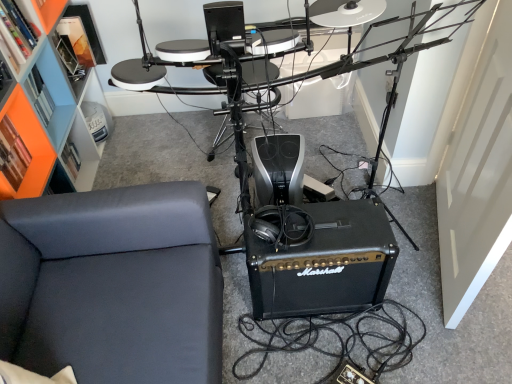
Question: Considering the relative sizes of black leather couch at lower left and black matte marshall amplifier at center in the image provided, is black leather couch at lower left shorter than black matte marshall amplifier at center?

Choices:
 (A) no
 (B) yes

Answer: (A)

Question: From a real-world perspective, is black leather couch at lower left physically below black matte marshall amplifier at center?

Choices:
 (A) no
 (B) yes

Answer: (A)

Question: From the image's perspective, does black leather couch at lower left appear higher than black matte marshall amplifier at center?

Choices:
 (A) no
 (B) yes

Answer: (A)

Question: From the image's perspective, is black leather couch at lower left under black matte marshall amplifier at center?

Choices:
 (A) no
 (B) yes

Answer: (B)

Question: Is black leather couch at lower left at the left side of black matte marshall amplifier at center?

Choices:
 (A) no
 (B) yes

Answer: (B)

Question: Is point (74, 200) closer or farther from the camera than point (22, 18)?

Choices:
 (A) closer
 (B) farther

Answer: (A)

Question: Is black leather couch at lower left bigger or smaller than orange matte bookshelf at upper left?

Choices:
 (A) small
 (B) big

Answer: (B)

Question: Is black leather couch at lower left taller or shorter than orange matte bookshelf at upper left?

Choices:
 (A) tall
 (B) short

Answer: (A)

Question: Choose the correct answer: Is black leather couch at lower left inside orange matte bookshelf at upper left or outside it?

Choices:
 (A) outside
 (B) inside

Answer: (A)

Question: In terms of size, does orange matte bookshelf at upper left appear bigger or smaller than black plastic drum set at center?

Choices:
 (A) big
 (B) small

Answer: (B)

Question: From the image's perspective, is orange matte bookshelf at upper left located above or below black plastic drum set at center?

Choices:
 (A) below
 (B) above

Answer: (B)

Question: From a real-world perspective, is orange matte bookshelf at upper left above or below black plastic drum set at center?

Choices:
 (A) above
 (B) below

Answer: (A)

Question: In the image, is orange matte bookshelf at upper left positioned in front of or behind black plastic drum set at center?

Choices:
 (A) behind
 (B) front

Answer: (A)

Question: Looking at their shapes, would you say orange matte bookshelf at upper left is wider or thinner than black leather couch at lower left?

Choices:
 (A) thin
 (B) wide

Answer: (A)

Question: Considering the positions of orange matte bookshelf at upper left and black leather couch at lower left in the image, is orange matte bookshelf at upper left bigger or smaller than black leather couch at lower left?

Choices:
 (A) big
 (B) small

Answer: (B)